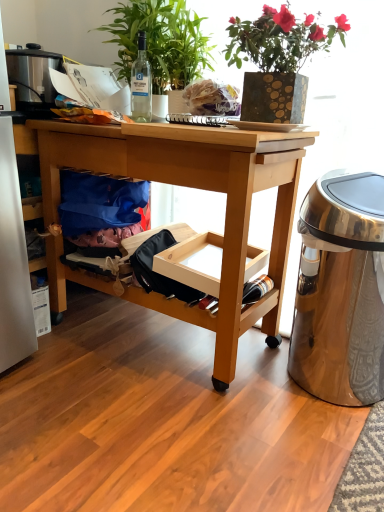
You are a GUI agent. You are given a task and a screenshot of the screen. Output one action in this format:
    pyautogui.click(x=<x>, y=<y>)
    Task: Click on the free space in front of light wood desk at center
    
    Given the screenshot: What is the action you would take?
    pyautogui.click(x=167, y=448)